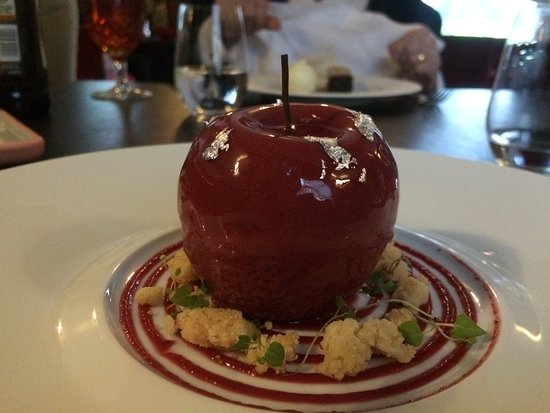
Where is `napkin`? napkin is located at coordinates (359, 36).